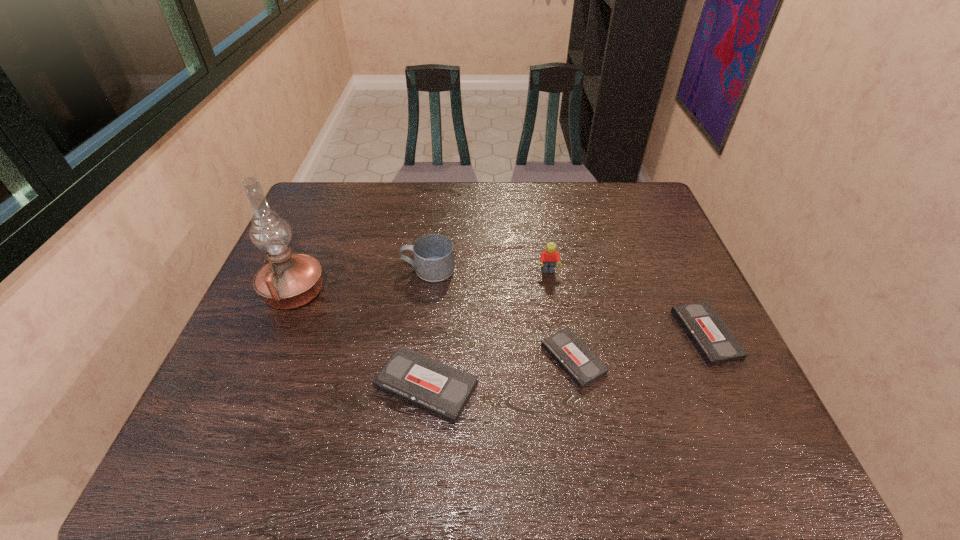
Where is `blank space at the near edge of the desktop`? This screenshot has height=540, width=960. blank space at the near edge of the desktop is located at coordinates (329, 385).

Locate an element on the screen. Image resolution: width=960 pixels, height=540 pixels. free spot at the left edge of the desktop is located at coordinates (310, 324).

In order to click on free point at the right edge in this screenshot , I will do `click(650, 281)`.

The width and height of the screenshot is (960, 540). Find the location of `vacant space at the far left corner`. vacant space at the far left corner is located at coordinates (324, 186).

Where is `vacant space at the near left corner of the desktop`? This screenshot has height=540, width=960. vacant space at the near left corner of the desktop is located at coordinates (246, 421).

Image resolution: width=960 pixels, height=540 pixels. In order to click on vacant space at the far right corner of the desktop in this screenshot , I will do `click(615, 212)`.

I want to click on vacant space that is in between the Lego and the shortest object, so click(561, 315).

You are a GUI agent. You are given a task and a screenshot of the screen. Output one action in this format:
    pyautogui.click(x=<x>, y=<y>)
    Task: Click on the free space between the Lego and the mug
    
    Given the screenshot: What is the action you would take?
    pyautogui.click(x=489, y=271)

You are a GUI agent. You are given a task and a screenshot of the screen. Output one action in this format:
    pyautogui.click(x=<x>, y=<y>)
    Task: Click on the free area in between the leftmost object and the Lego
    
    Given the screenshot: What is the action you would take?
    pyautogui.click(x=421, y=282)

Identify the location of vacant space that's between the mug and the shortest videotape. This screenshot has height=540, width=960. (501, 314).